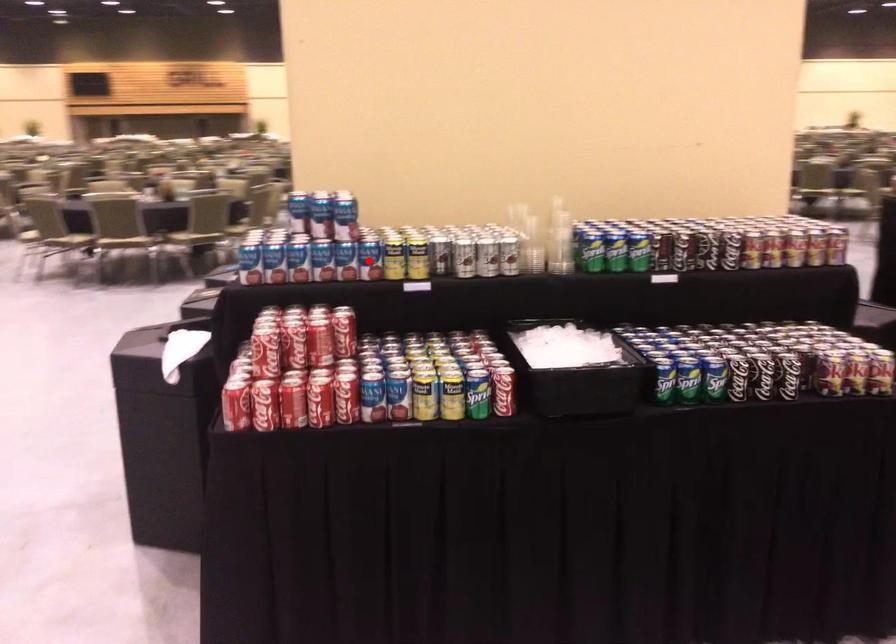
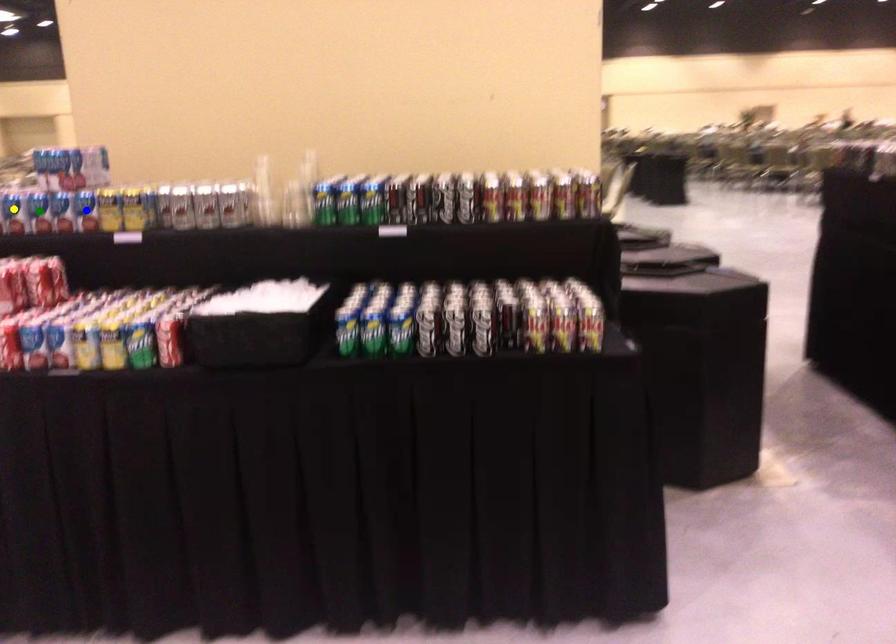
Question: I am providing you with two images of the same scene from different viewpoints. A red point is marked on the first image. You are given multiple points on the second image. In image 2, which mark is for the same physical point as the one in image 1?

Choices:
 (A) yellow point
 (B) green point
 (C) blue point

Answer: (C)